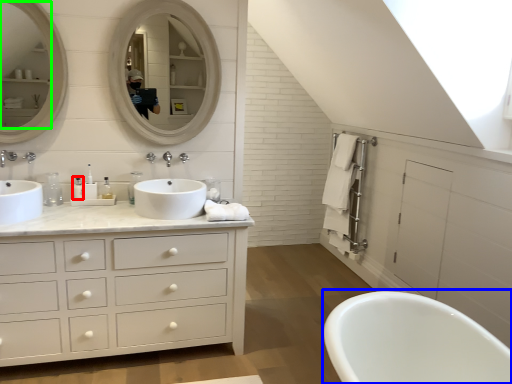
Question: Which is nearer to the toiletry (highlighted by a red box)? bath (highlighted by a blue box) or mirror (highlighted by a green box).

Choices:
 (A) bath
 (B) mirror

Answer: (B)